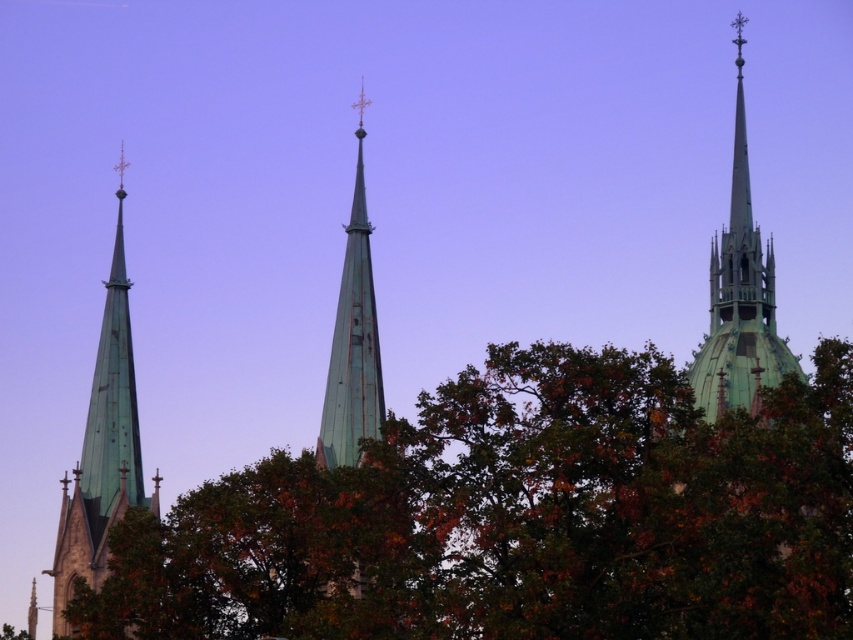
Question: Among these points, which one is farthest from the camera?

Choices:
 (A) (746, 160)
 (B) (492, 410)

Answer: (A)

Question: From the image, what is the correct spatial relationship of green leafy tree at center in relation to green copper spire at left?

Choices:
 (A) right
 (B) left

Answer: (A)

Question: Where is green leafy tree at center located in relation to green copper spire at left in the image?

Choices:
 (A) right
 (B) left

Answer: (A)

Question: Which point appears farthest from the camera in this image?

Choices:
 (A) (733, 339)
 (B) (294, 620)
 (C) (105, 378)

Answer: (C)

Question: Among these objects, which one is farthest from the camera?

Choices:
 (A) green copper spire at left
 (B) green copper spire at upper right
 (C) green leafy tree at center

Answer: (A)

Question: From the image, what is the correct spatial relationship of green leafy tree at center in relation to green copper spire at upper right?

Choices:
 (A) left
 (B) right

Answer: (A)